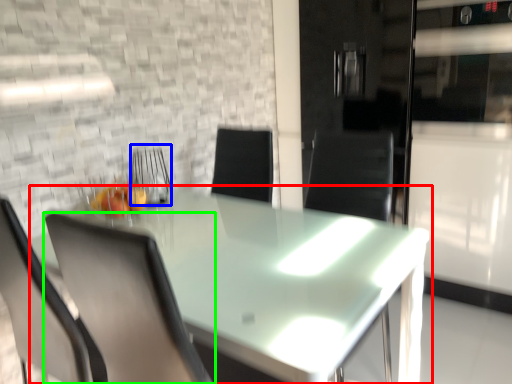
Question: Which object is positioned farthest from table (highlighted by a red box)? Select from armchair (highlighted by a blue box) and chair (highlighted by a green box).

Choices:
 (A) armchair
 (B) chair

Answer: (A)